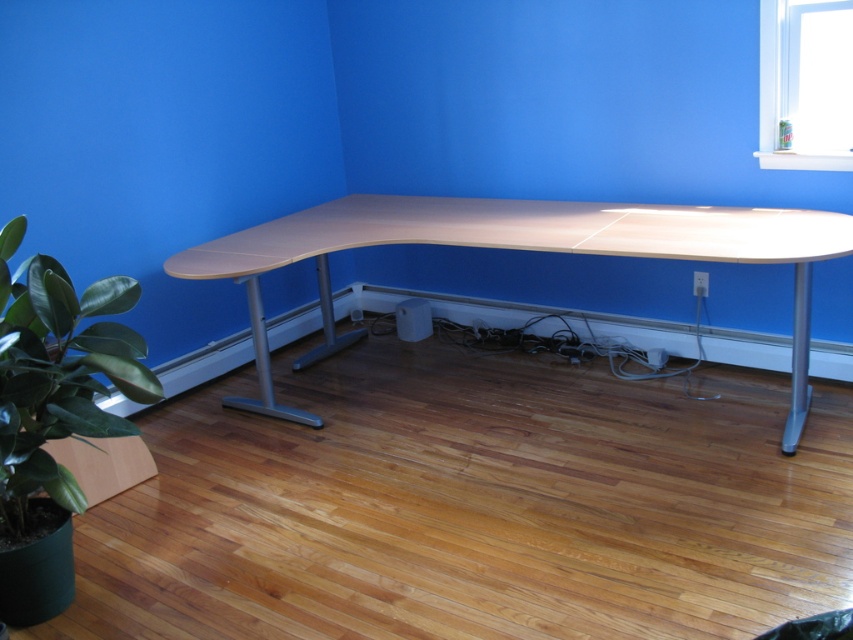
You are standing in the room and want to place a new potted plant exactly where the green rubbery plant at lower left is currently located. What are the coordinates you should aim for?

The coordinates for the green rubbery plant at lower left are at point (57, 374), so you should aim for those coordinates.